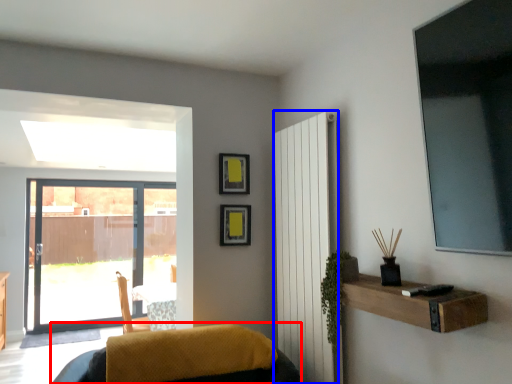
Question: Among these objects, which one is farthest to the camera, furniture (highlighted by a red box) or radiator (highlighted by a blue box)?

Choices:
 (A) furniture
 (B) radiator

Answer: (B)